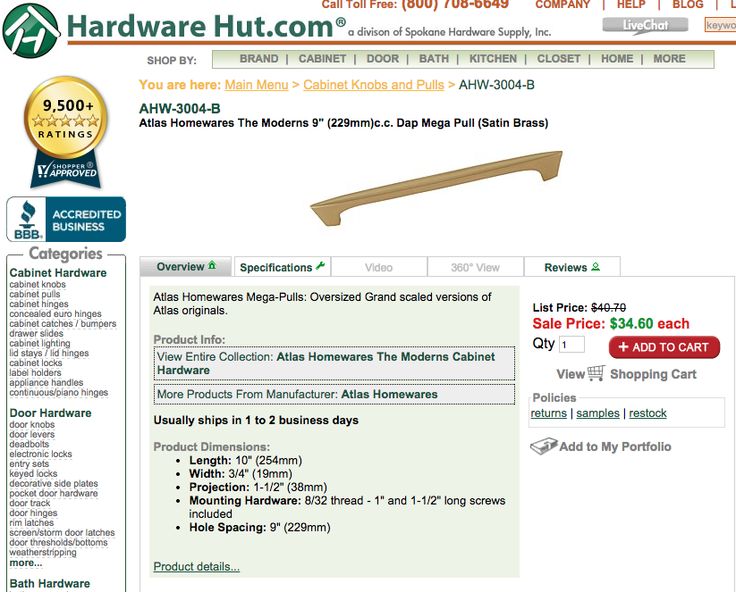
You are a GUI agent. You are given a task and a screenshot of the screen. Output one action in this format:
    pyautogui.click(x=<x>, y=<y>)
    Task: Click on the gold drawer pull
    The image size is (736, 592).
    Given the screenshot: What is the action you would take?
    pyautogui.click(x=442, y=176)